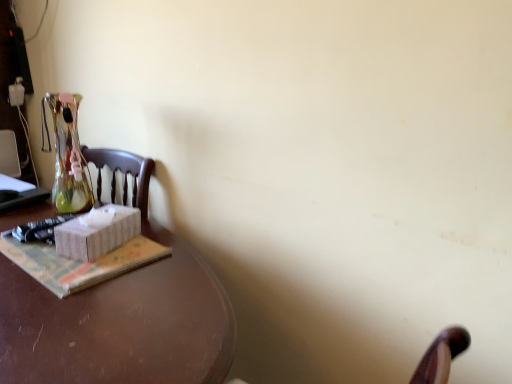
Question: Is brown polished wood desk at left positioned with its back to white paper at left?

Choices:
 (A) yes
 (B) no

Answer: (B)

Question: Is the position of brown polished wood desk at left less distant than that of white paper at left?

Choices:
 (A) no
 (B) yes

Answer: (B)

Question: Can you confirm if brown polished wood desk at left is thinner than white paper at left?

Choices:
 (A) no
 (B) yes

Answer: (A)

Question: Can you confirm if brown polished wood desk at left is smaller than white paper at left?

Choices:
 (A) yes
 (B) no

Answer: (B)

Question: Considering the relative sizes of brown polished wood desk at left and white paper at left in the image provided, is brown polished wood desk at left bigger than white paper at left?

Choices:
 (A) yes
 (B) no

Answer: (A)

Question: Do you think white paper at left is within brown polished wood desk at left, or outside of it?

Choices:
 (A) inside
 (B) outside

Answer: (A)

Question: Relative to brown polished wood desk at left, is white paper at left in front or behind?

Choices:
 (A) behind
 (B) front

Answer: (A)

Question: In terms of height, does white paper at left look taller or shorter compared to brown polished wood desk at left?

Choices:
 (A) short
 (B) tall

Answer: (A)

Question: In terms of width, does white paper at left look wider or thinner when compared to brown polished wood desk at left?

Choices:
 (A) thin
 (B) wide

Answer: (A)

Question: Is white wicker box at left inside the boundaries of brown polished wood desk at left, or outside?

Choices:
 (A) outside
 (B) inside

Answer: (A)

Question: Considering the relative positions of white wicker box at left and brown polished wood desk at left in the image provided, is white wicker box at left to the left or to the right of brown polished wood desk at left?

Choices:
 (A) right
 (B) left

Answer: (A)

Question: Considering the positions of point click(x=70, y=236) and point click(x=184, y=246), is point click(x=70, y=236) closer or farther from the camera than point click(x=184, y=246)?

Choices:
 (A) closer
 (B) farther

Answer: (A)

Question: Is white wicker box at left bigger or smaller than brown polished wood desk at left?

Choices:
 (A) big
 (B) small

Answer: (B)

Question: From the image's perspective, is white wicker box at left located above or below white paper at left?

Choices:
 (A) below
 (B) above

Answer: (B)

Question: In terms of height, does white wicker box at left look taller or shorter compared to white paper at left?

Choices:
 (A) short
 (B) tall

Answer: (B)